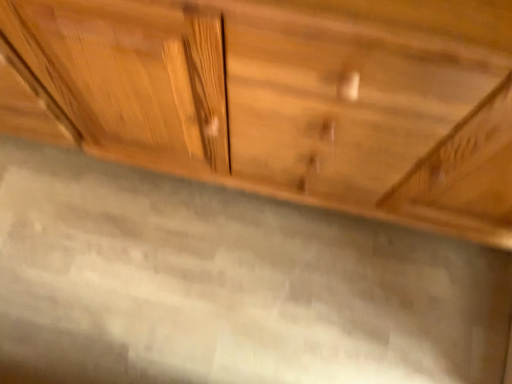
Question: From a real-world perspective, is gray polished granite at center positioned above or below natural wood cabinet at center?

Choices:
 (A) above
 (B) below

Answer: (B)

Question: From the image's perspective, relative to natural wood cabinet at center, is gray polished granite at center above or below?

Choices:
 (A) above
 (B) below

Answer: (B)

Question: Considering their positions, is gray polished granite at center located in front of or behind natural wood cabinet at center?

Choices:
 (A) behind
 (B) front

Answer: (A)

Question: Considering the positions of natural wood cabinet at center and gray polished granite at center in the image, is natural wood cabinet at center bigger or smaller than gray polished granite at center?

Choices:
 (A) small
 (B) big

Answer: (B)

Question: Is natural wood cabinet at center to the left or to the right of gray polished granite at center in the image?

Choices:
 (A) left
 (B) right

Answer: (B)

Question: From a real-world perspective, is natural wood cabinet at center positioned above or below gray polished granite at center?

Choices:
 (A) below
 (B) above

Answer: (B)

Question: From the image's perspective, is natural wood cabinet at center positioned above or below gray polished granite at center?

Choices:
 (A) below
 (B) above

Answer: (B)